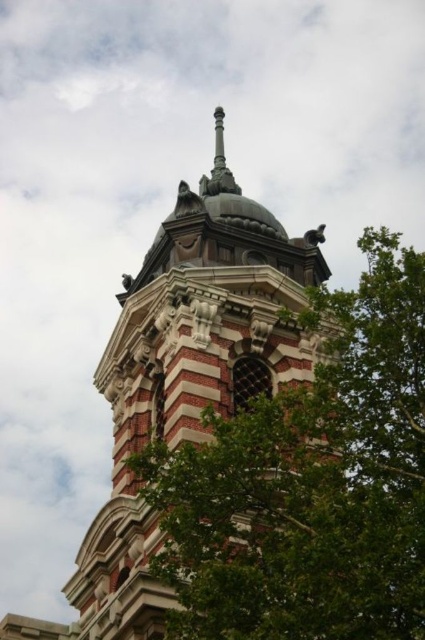
Question: Where is polished stone tower at center located in relation to polished brass spire at center top in the image?

Choices:
 (A) right
 (B) left

Answer: (B)

Question: Which is farther from the polished stone tower at center?

Choices:
 (A) green leafy tree at center
 (B) polished brass spire at center top

Answer: (B)

Question: Based on their relative distances, which object is farther from the polished stone tower at center?

Choices:
 (A) green leafy tree at center
 (B) polished brass spire at center top

Answer: (B)

Question: Which of the following is the farthest from the observer?

Choices:
 (A) (237, 193)
 (B) (155, 310)

Answer: (A)

Question: Does green leafy tree at center have a larger size compared to polished brass spire at center top?

Choices:
 (A) yes
 (B) no

Answer: (A)

Question: Does green leafy tree at center lie behind polished brass spire at center top?

Choices:
 (A) yes
 (B) no

Answer: (B)